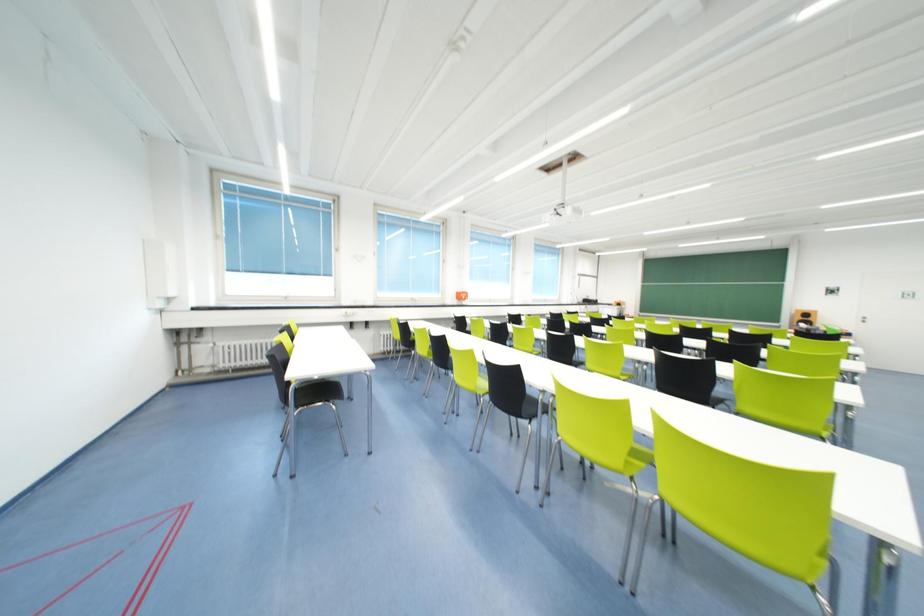
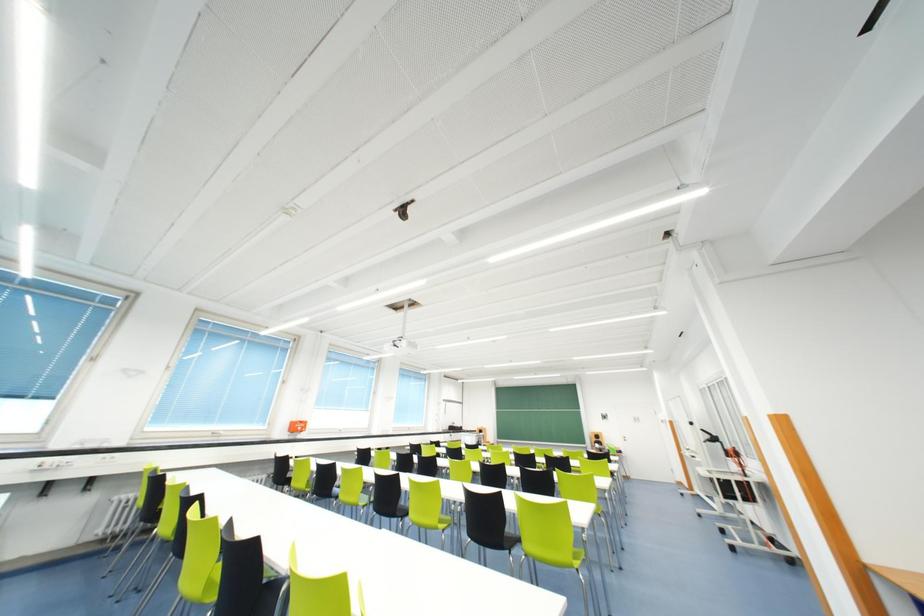
Based on the continuous images, in which direction is the camera rotating?

The rotation direction of the camera is right-up.